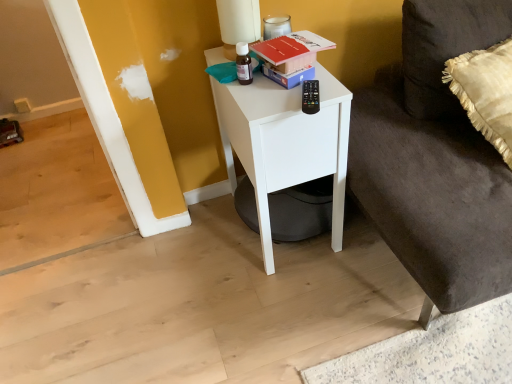
Question: Choose the correct answer: Is white matte nightstand at center inside matte white table lamp at upper center or outside it?

Choices:
 (A) inside
 (B) outside

Answer: (B)

Question: Is white matte nightstand at center to the left or to the right of matte white table lamp at upper center in the image?

Choices:
 (A) left
 (B) right

Answer: (B)

Question: Which is farther from the dark gray fabric couch at lower right?

Choices:
 (A) red matte book at upper center
 (B) matte white table lamp at upper center
 (C) white matte nightstand at center
 (D) silky beige pillow at right

Answer: (B)

Question: Estimate the real-world distances between objects in this image. Which object is closer to the silky beige pillow at right?

Choices:
 (A) red matte book at upper center
 (B) dark gray fabric couch at lower right
 (C) white matte nightstand at center
 (D) matte white table lamp at upper center

Answer: (B)